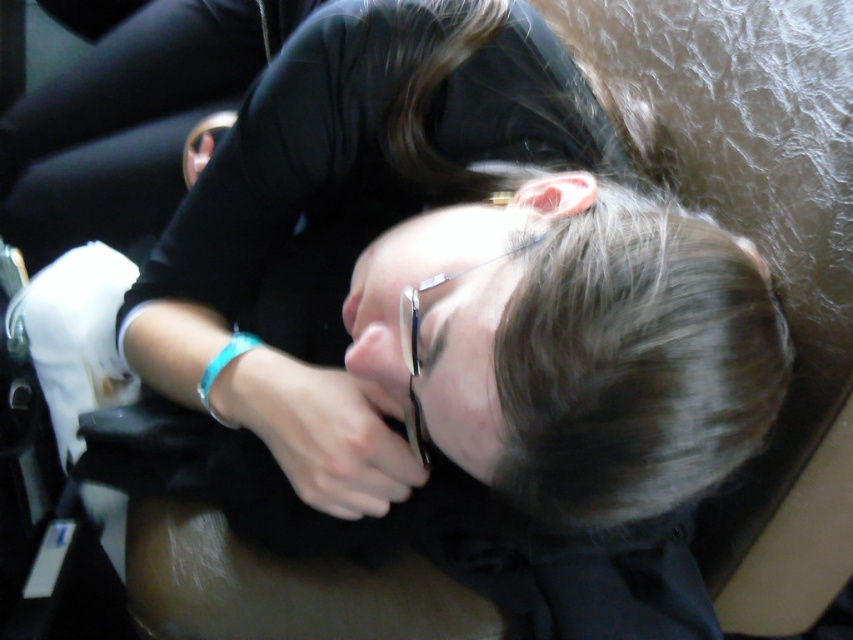
You are taking a photo of two people in the scene. You want to focus on the person closer to the camera. Which point should you focus on, point (708, 266) or point (397, 496)?

Point (708, 266) is closer to the camera than point (397, 496), so you should focus on point (708, 266).

You are a photographer trying to capture a close detail shot of both the dark brown silky hair at center and the turquoise plastic bracelet at lower center. Since the camera can only focus on one object at a time, which object should you choose to ensure the subject with the larger width is in focus?

The dark brown silky hair at center might be wider than the turquoise plastic bracelet at lower center, so you should focus on the dark brown silky hair at center to ensure the larger subject is in focus.

You are a photographer adjusting the focus of your camera. You need to capture both the dark brown silky hair at center and the turquoise plastic bracelet at lower center in sharp detail. Given that your camera can only focus on objects within a 10 inch range, will both objects be in focus?

The dark brown silky hair at center and the turquoise plastic bracelet at lower center are 12.31 inches apart from each other. Since the distance between them exceeds the camera focus range of 10 inches, both objects cannot be in focus simultaneously.